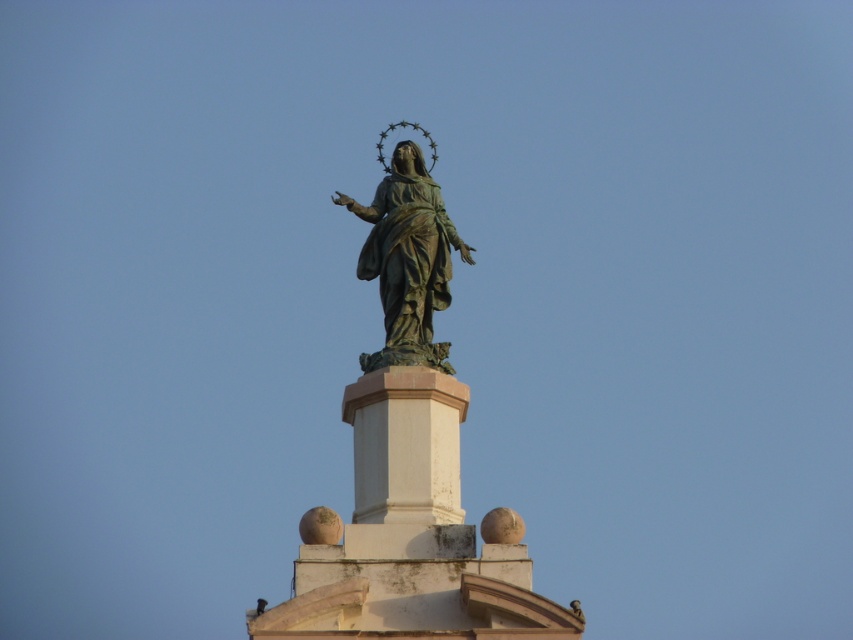
You are an art conservator assessing the statue and pedestal. Based on the scene, which object is shorter in height between the white stone pedestal at center and the bronze statue at center?

The white stone pedestal at center is shorter in height compared to the bronze statue at center.

You are standing in front of the statue and want to touch the pedestal. Since both the white stone pedestal at center and the bronze statue at center are in front of you, which one can you reach first?

The white stone pedestal at center is closer to the viewer than the bronze statue at center, so you can reach it first.